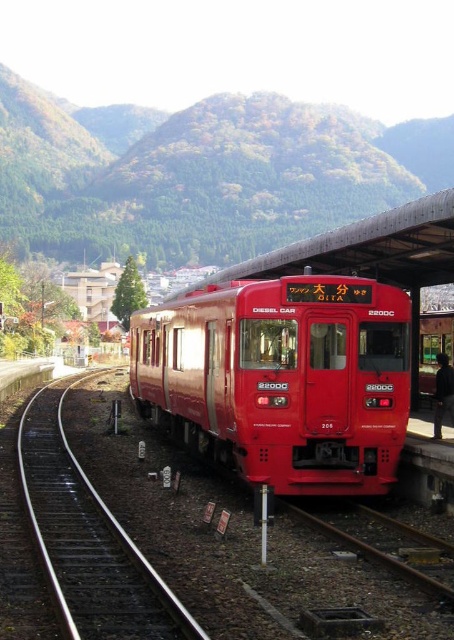
You are a passenger waiting at the platform for the 2200C diesel train. You notice a specific point marked at coordinates (281, 380). According to the scene, what object is located at that point?

The point at coordinates (281, 380) marks the shiny red train at center.